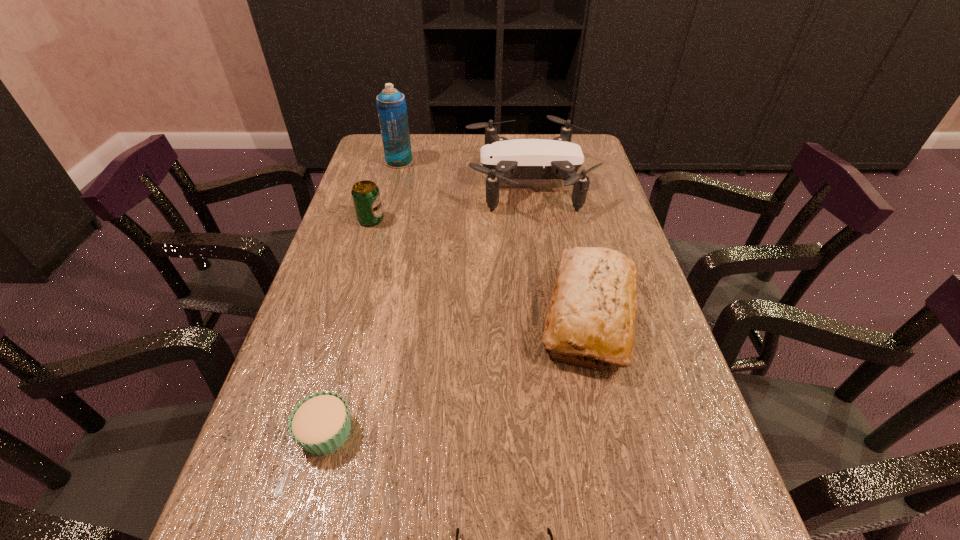
I want to click on object at the far left corner, so click(x=391, y=105).

Where is `object located at the far right corner`? This screenshot has height=540, width=960. object located at the far right corner is located at coordinates (502, 159).

Image resolution: width=960 pixels, height=540 pixels. Identify the location of vacant space at the far edge of the desktop. (425, 133).

You are a GUI agent. You are given a task and a screenshot of the screen. Output one action in this format:
    pyautogui.click(x=<x>, y=<y>)
    Task: Click on the vacant space at the left edge of the desktop
    This screenshot has width=960, height=540.
    Given the screenshot: What is the action you would take?
    pyautogui.click(x=229, y=506)

In the image, there is a desktop. Where is `free space at the right edge`? free space at the right edge is located at coordinates (579, 233).

The image size is (960, 540). What are the coordinates of `vacant position at the far left corner of the desktop` in the screenshot? It's located at (370, 161).

Where is `free space between the bread and the drone`? free space between the bread and the drone is located at coordinates (559, 249).

The image size is (960, 540). I want to click on unoccupied area between the beer can and the tallest object, so click(385, 191).

Identify the location of empty space between the cupcake and the drone. 427,307.

Where is `vacant region between the fifth farthest object and the beer can`? vacant region between the fifth farthest object and the beer can is located at coordinates (348, 326).